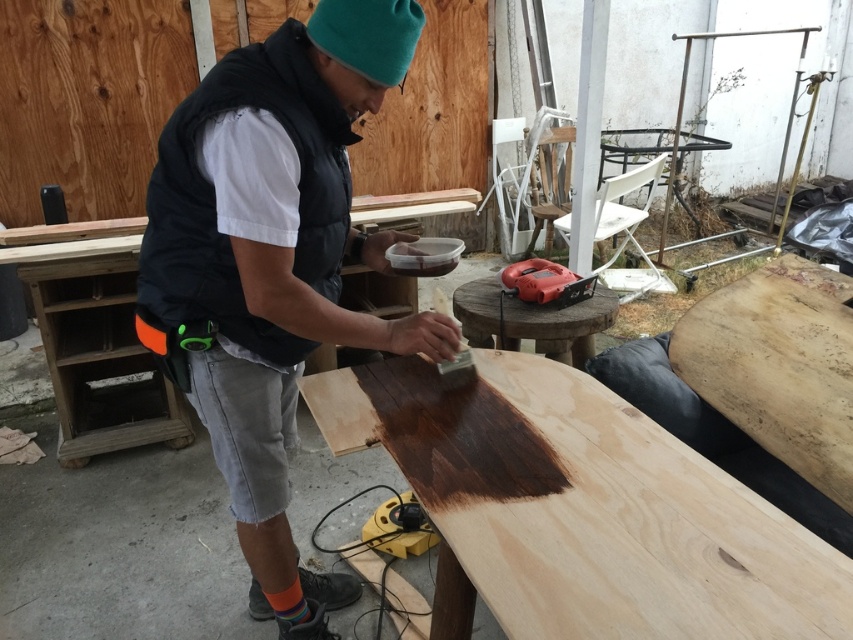
You are a carpenter working in an outdoor workshop. You need to place a heavy tool on a wooden surface. Which surface would be more stable to place it on, the dark stained wood at center or the natural wood plywood at lower right?

The dark stained wood at center is in front of the natural wood plywood at lower right, so it is closer to you. Since the dark stained wood at center is the surface you are currently working on, it is more stable to place the heavy tool there.

You are a drone operator trying to capture a closeup shot of the matte black vest at center. The drone has a minimum safe distance of 1 meter to avoid crashing into objects. Can the drone safely hover at 1 meter away to take the photo?

The distance between the matte black vest at center and the camera is 1.09 meters, which is just above the drone minimum safe distance of 1 meter. Therefore, the drone can safely hover at 1 meter away to take the photo.